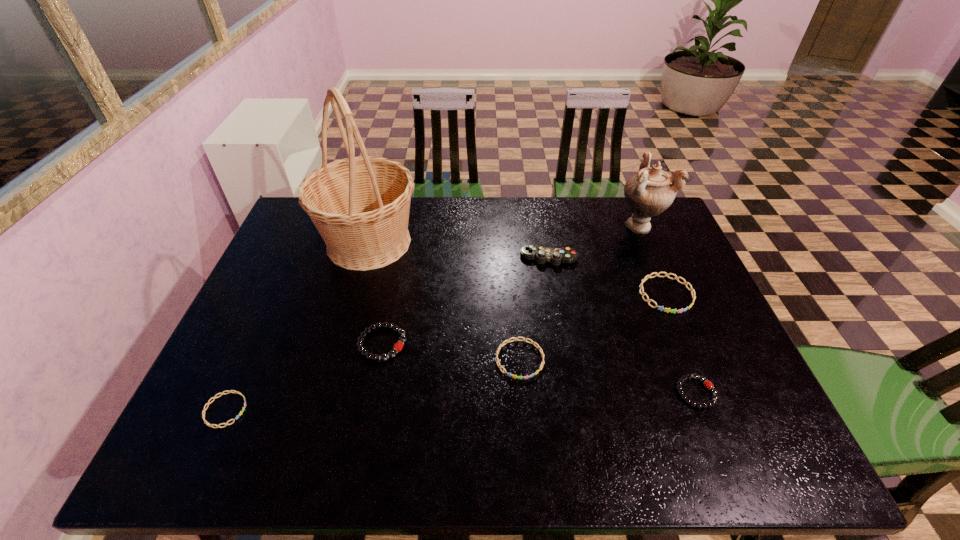
Locate an element on the screen. Image resolution: width=960 pixels, height=540 pixels. basket is located at coordinates (360, 205).

Identify the location of urn. (648, 193).

The image size is (960, 540). I want to click on the sixth shortest object, so click(x=555, y=256).

Find the location of a particular element. This screenshot has width=960, height=540. the farthest blue bracelet is located at coordinates (642, 293).

This screenshot has width=960, height=540. I want to click on the biggest blue bracelet, so click(x=642, y=293).

Locate an element on the screen. the second bracelet from left to right is located at coordinates (397, 347).

Find the location of a particular element. The width and height of the screenshot is (960, 540). the left black bracelet is located at coordinates (397, 347).

This screenshot has height=540, width=960. In order to click on the third bracelet from left to right in this screenshot , I will do `click(524, 339)`.

Identify the location of the second nearest blue bracelet. (524, 339).

Identify the location of the nearer black bracelet. Image resolution: width=960 pixels, height=540 pixels. (707, 384).